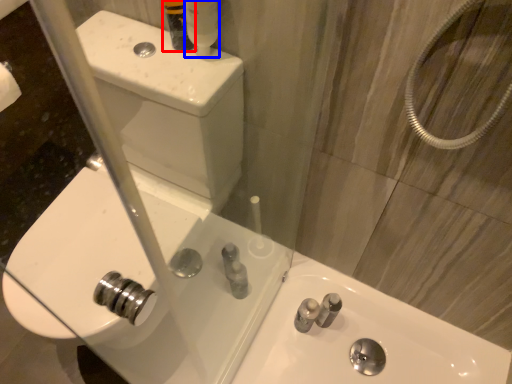
Question: Which object appears farthest to the camera in this image, toiletry (highlighted by a red box) or mouthwash (highlighted by a blue box)?

Choices:
 (A) toiletry
 (B) mouthwash

Answer: (A)